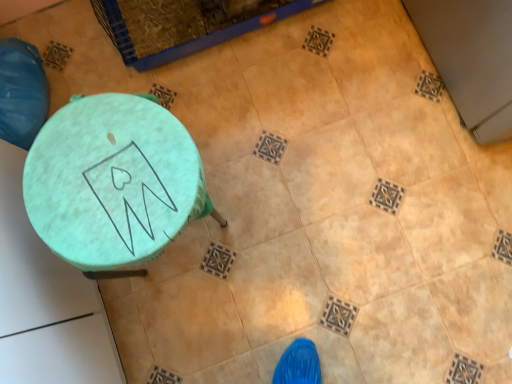
The height and width of the screenshot is (384, 512). I want to click on free space to the back side of teal fabric-covered stool at lower left, so click(x=205, y=103).